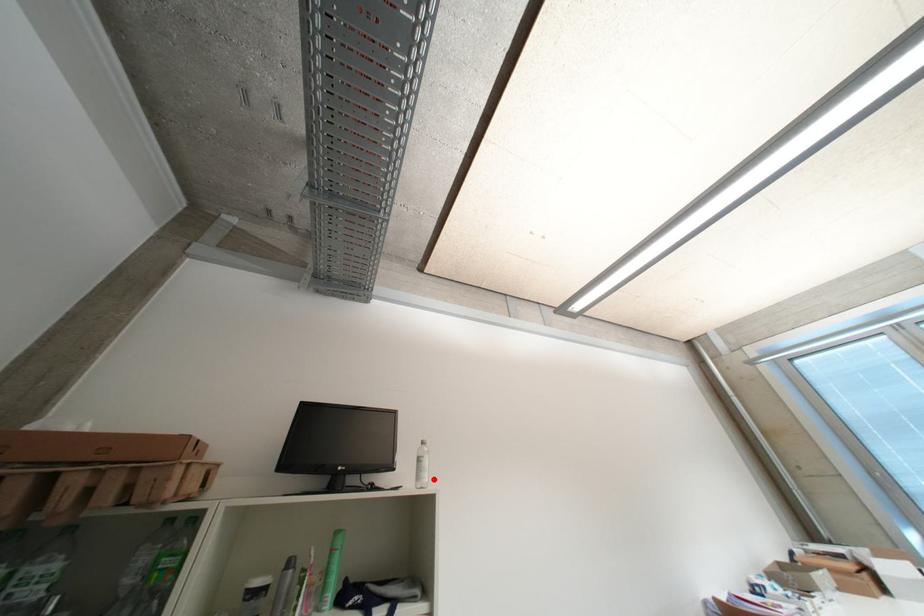
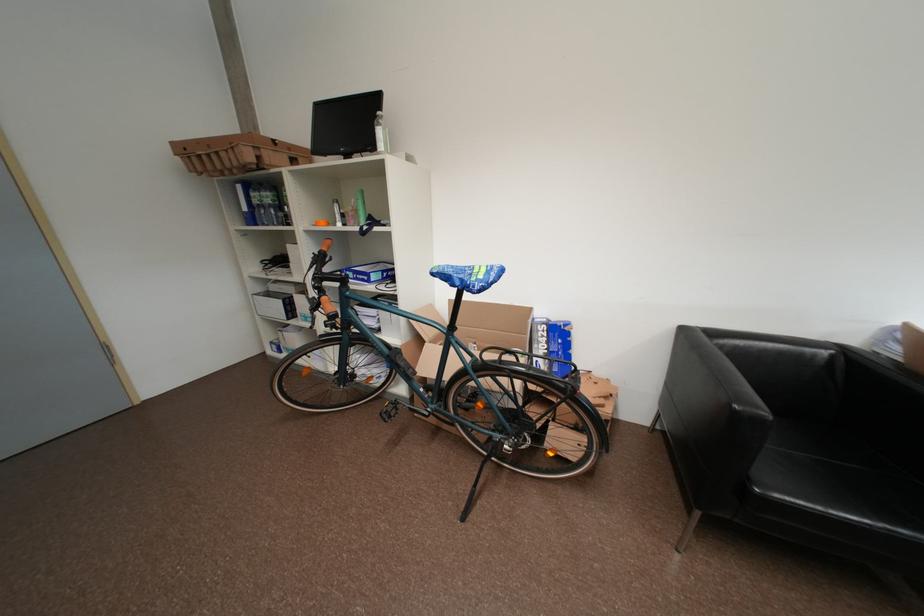
In the second image, find the point that corresponds to the highlighted location in the first image.

(388, 148)